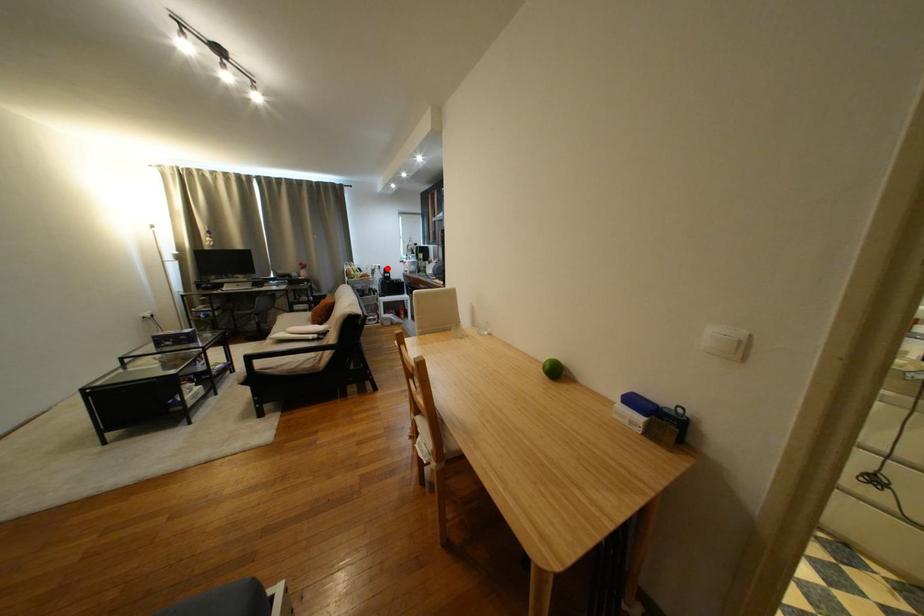
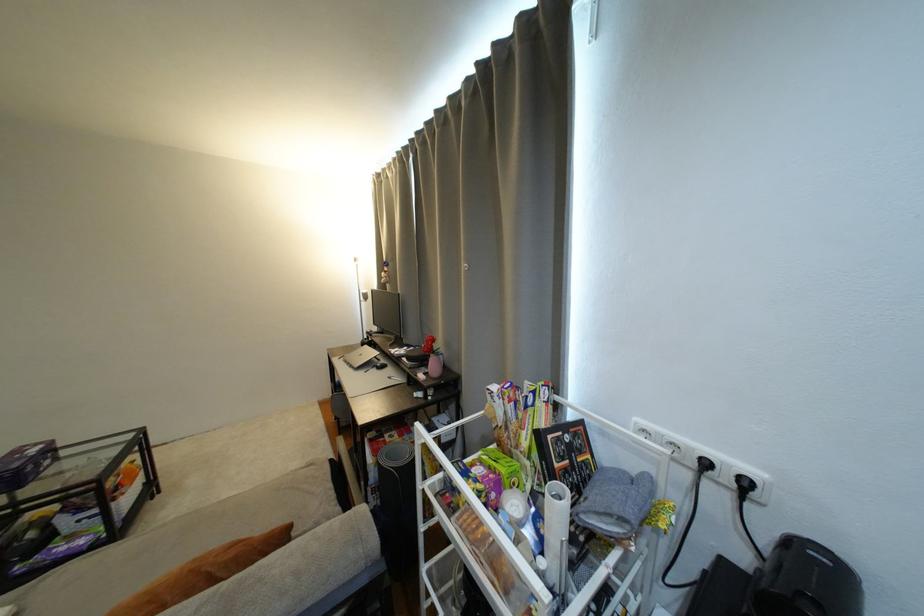
Locate, in the second image, the point that corresponds to the highlighted location in the first image.

(754, 485)